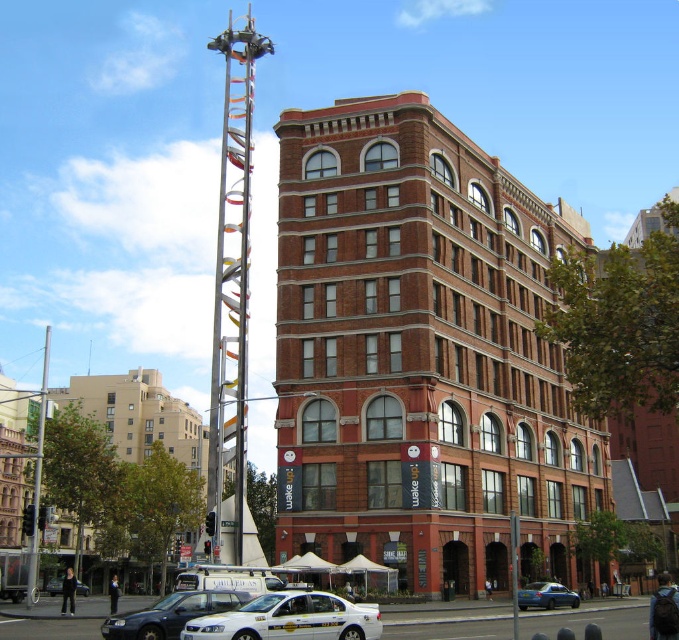
Question: Is white plastic taxi at lower center thinner than metallic silver taxi at lower left?

Choices:
 (A) no
 (B) yes

Answer: (A)

Question: Observing the image, what is the correct spatial positioning of brown brick building at center in reference to silver metallic pole at left?

Choices:
 (A) right
 (B) left

Answer: (A)

Question: From the image, what is the correct spatial relationship of white glossy taxi at lower center in relation to blue metallic sedan at lower center?

Choices:
 (A) above
 (B) below

Answer: (A)

Question: Among these objects, which one is nearest to the camera?

Choices:
 (A) brown brick building at center
 (B) white glossy taxi cab at lower center

Answer: (B)

Question: Among these points, which one is nearest to the camera?

Choices:
 (A) (31, 525)
 (B) (232, 577)
 (C) (146, 620)

Answer: (C)

Question: Which of the following is the closest to the observer?

Choices:
 (A) white plastic taxi at lower center
 (B) brown brick building at center
 (C) silver metallic pole at left

Answer: (A)